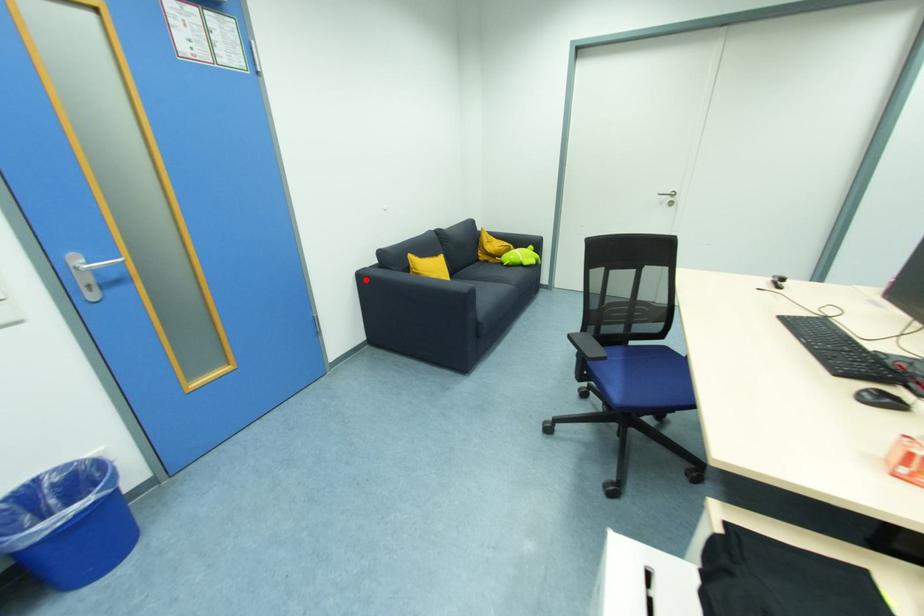
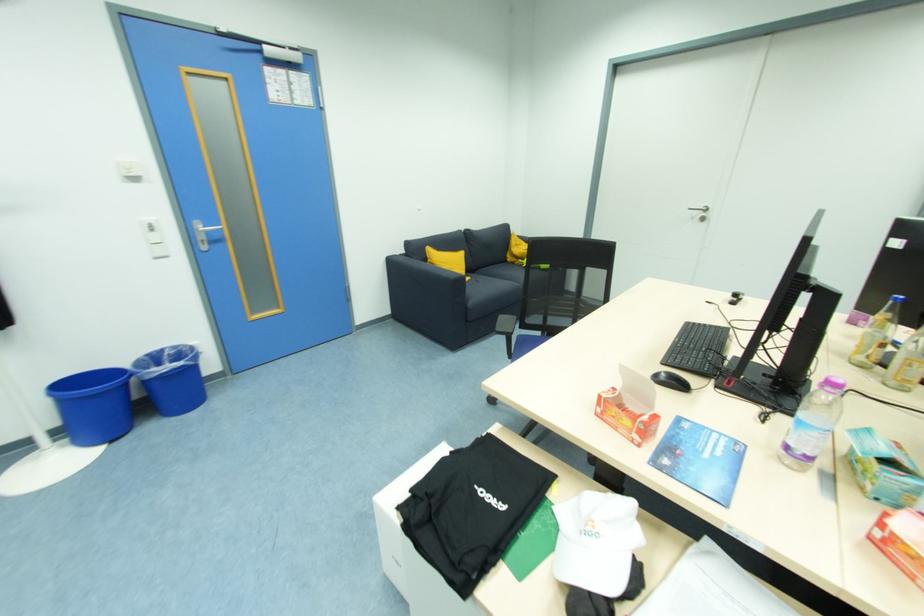
Question: I am providing you with two images of the same scene from different viewpoints. A red point is marked on the first image. At the location where the point appears in image 1, is it still visible in image 2?

Choices:
 (A) Yes
 (B) No

Answer: (A)